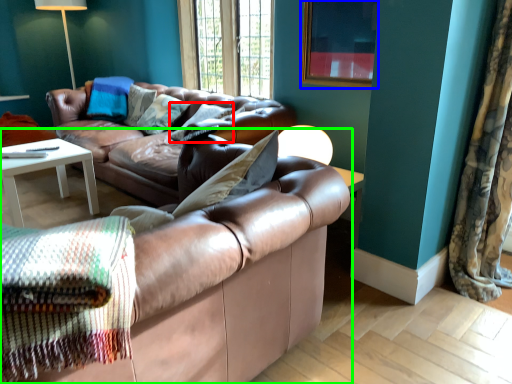
Question: Which object is the closest to the pillow (highlighted by a red box)? Choose among these: picture frame (highlighted by a blue box) or studio couch (highlighted by a green box).

Choices:
 (A) picture frame
 (B) studio couch

Answer: (A)